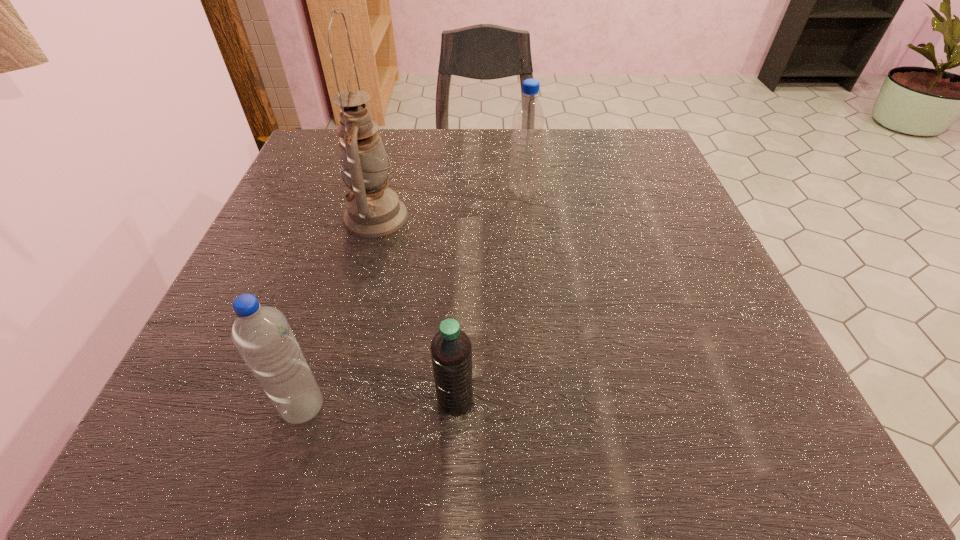
Identify the location of the tallest object. (373, 210).

Where is `the farthest water bottle`? Image resolution: width=960 pixels, height=540 pixels. the farthest water bottle is located at coordinates (528, 120).

Identify the location of the rightmost object. This screenshot has height=540, width=960. (528, 120).

At what (x,y) coordinates should I click in order to perform the action: click on the leftmost water bottle. Please return your answer as a coordinate pair (x, y). This screenshot has height=540, width=960. Looking at the image, I should click on (262, 335).

Where is `the shortest object`? the shortest object is located at coordinates (451, 350).

Image resolution: width=960 pixels, height=540 pixels. What are the coordinates of `the shortest water bottle` in the screenshot? It's located at (451, 350).

Where is `vacant space located 0.350m on the right of the oil lamp`? vacant space located 0.350m on the right of the oil lamp is located at coordinates (585, 217).

Where is `free location located on the left of the farthest water bottle`? The height and width of the screenshot is (540, 960). free location located on the left of the farthest water bottle is located at coordinates (466, 191).

Image resolution: width=960 pixels, height=540 pixels. I want to click on vacant space located on the right of the leftmost water bottle, so click(563, 407).

Identify the location of vacant space positioned on the back of the third object from left to right. (460, 290).